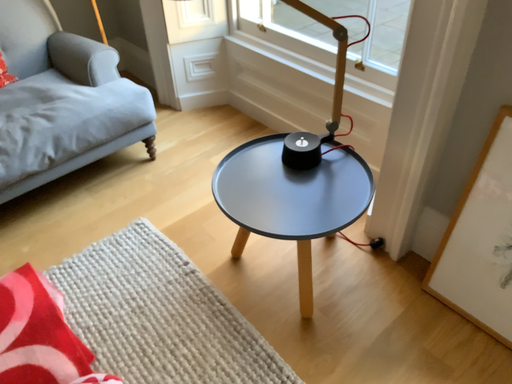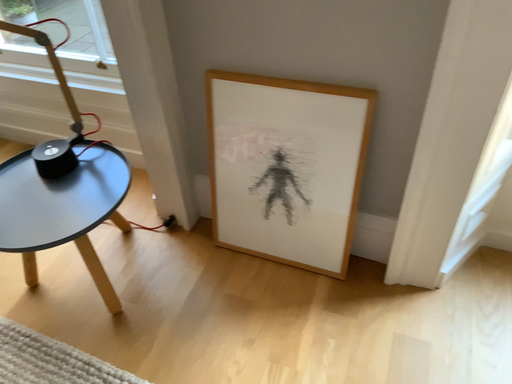
Question: Which way did the camera rotate in the video?

Choices:
 (A) rotated left
 (B) rotated right

Answer: (B)